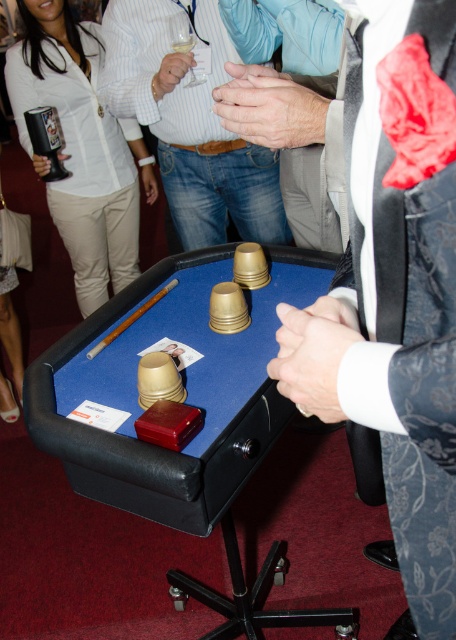
You are a game participant standing at the edge of the blue felt billiard table at center. Your hands, the smooth skin hands at center, need to reach the cups placed on the table. Given that the average human arm length is about 24 inches, can your hands reach the cups on the table?

The distance between the blue felt billiard table at center and the smooth skin hands at center is 19.67 inches. Since the average human arm length is 24 inches, the hands can easily reach the cups on the table as 19.67 inches is less than 24 inches.

Looking at this image, you are a game organizer and need to ensure that the matte brown hand at center can comfortably reach across the blue felt billiard table at center. Given their sizes, is this possible?

The blue felt billiard table at center is larger in size than the matte brown hand at center, so the hand can comfortably reach across the table.